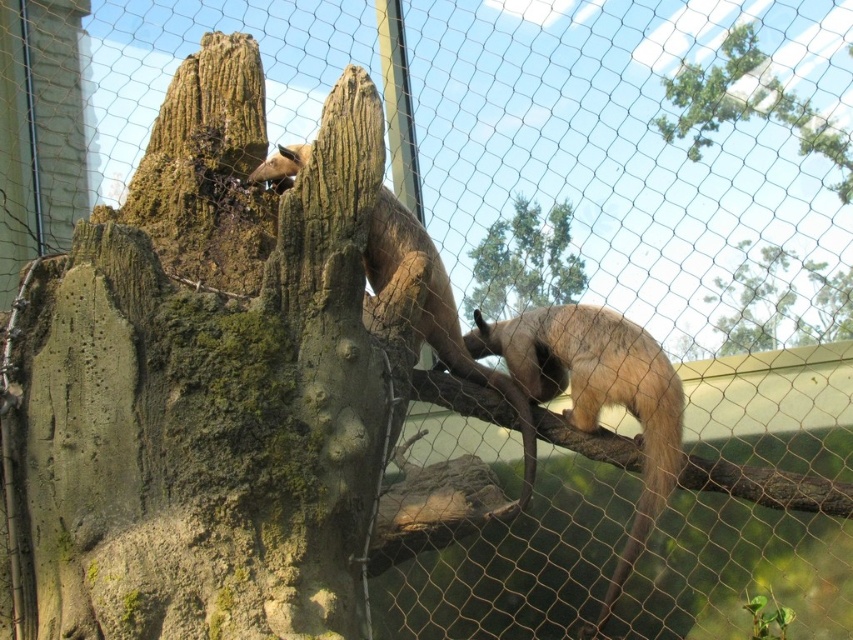
You are a zookeeper trying to place a feeding tray for the anteaters. The feeding tray needs to be placed between the green mossy tree trunk at upper right and the green mossy tree trunk at upper center. Based on their positions, which tree trunk should the feeding tray be closer to?

The green mossy tree trunk at upper right is positioned over the green mossy tree trunk at upper center, so the feeding tray should be placed closer to the green mossy tree trunk at upper center to ensure it is between them.

You are a zookeeper observing the anteaters in their enclosure. You notice the green mossy bark at upper left and the fuzzy brown anteater at center. Which object takes up more space in the image?

The green mossy bark at upper left is larger in size than the fuzzy brown anteater at center, so it takes up more space in the image.